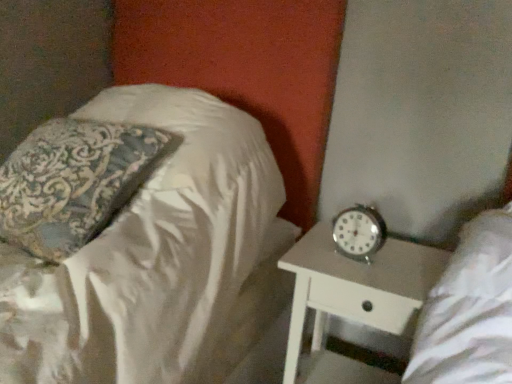
Question: Considering the positions of white glossy nightstand at lower right and silky white pillow at upper left in the image, is white glossy nightstand at lower right bigger or smaller than silky white pillow at upper left?

Choices:
 (A) big
 (B) small

Answer: (A)

Question: Considering the positions of point (300, 263) and point (219, 377), is point (300, 263) closer or farther from the camera than point (219, 377)?

Choices:
 (A) farther
 (B) closer

Answer: (A)

Question: Based on their relative distances, which object is nearer to the silky white pillow at upper left?

Choices:
 (A) white glossy nightstand at lower right
 (B) metallic silver clock at right

Answer: (A)

Question: Estimate the real-world distances between objects in this image. Which object is farther from the silky white pillow at upper left?

Choices:
 (A) white glossy nightstand at lower right
 (B) metallic silver clock at right

Answer: (B)